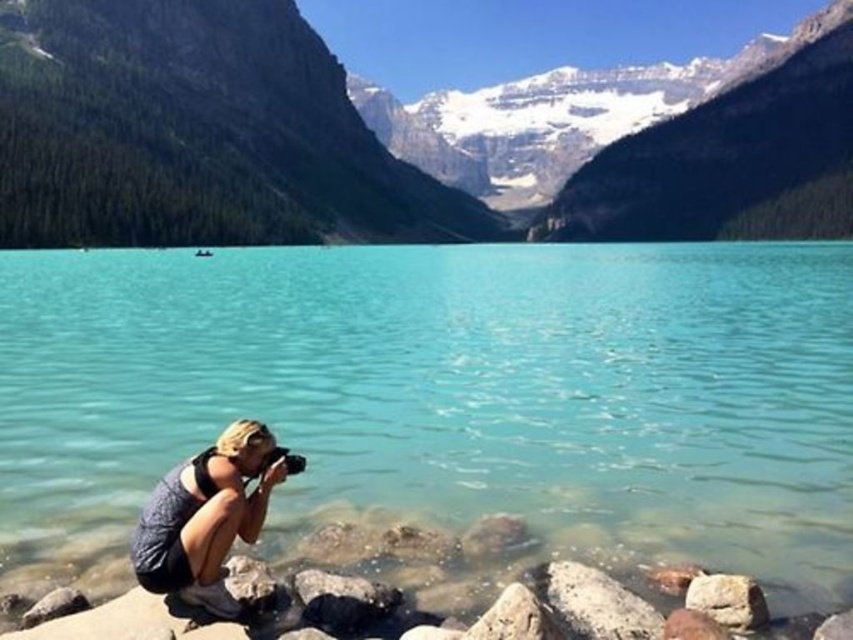
You are standing at the point marked by the coordinates point (x=399, y=138) in the image. What is the most prominent feature you can see in that location?

The point (x=399, y=138) marks green forested mountain at upper center, so the most prominent feature you can see in that location is the green forested mountain at upper center.

You are a photographer aiming to capture the lake and mountains in your shot. You have a gray fabric camera at lower left and a smooth gray rock at lower right. Which object is positioned closer to you, the photographer?

The gray fabric camera at lower left is closer to the viewer than the smooth gray rock at lower right, so the gray fabric camera at lower left is positioned closer to you, the photographer.

You are a photographer positioned at the edge of the lake. You notice two smooth gray rocks in your viewfinder. The first is labeled as smooth gray rock at lower center, and the second is smooth gray rock at lower right. Which rock is positioned to the left when looking from the photographer to the scene?

The smooth gray rock at lower center is positioned to the left of the smooth gray rock at lower right.